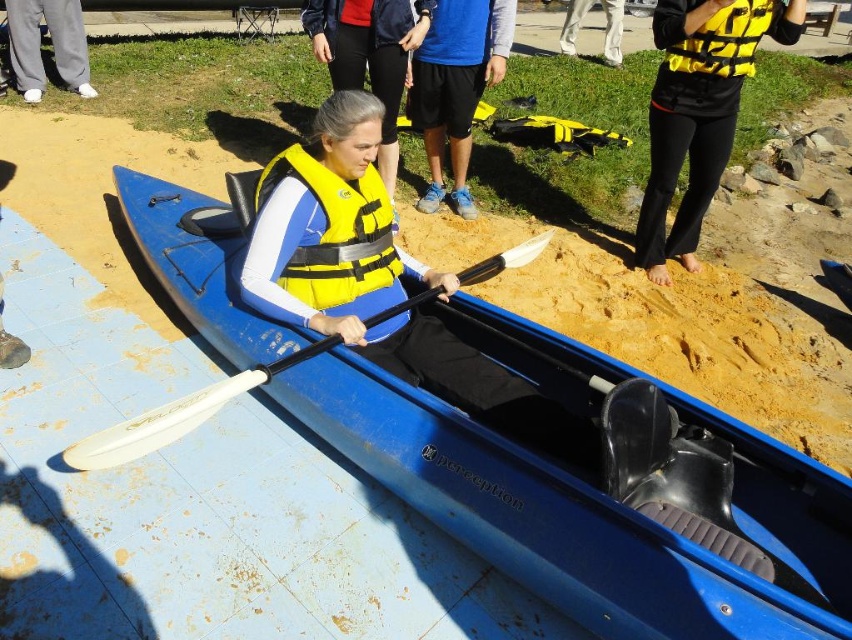
Does blue plastic kayak at center have a greater height compared to yellow/black life vest at upper right?

Indeed, blue plastic kayak at center has a greater height compared to yellow/black life vest at upper right.

Between point (548, 492) and point (686, 134), which one is positioned behind?

The point (686, 134) is behind.

The height and width of the screenshot is (640, 852). In order to click on blue plastic kayak at center in this screenshot , I will do `click(597, 490)`.

Which of these two, blue plastic kayak at center or yellow matte safety vest at center, stands shorter?

With less height is yellow matte safety vest at center.

Which is behind, point (216, 333) or point (317, 177)?

The point (216, 333) is behind.

I want to click on blue plastic kayak at center, so click(x=597, y=490).

Can you confirm if blue synthetic shorts at center is wider than yellow matte life jacket at upper center?

Indeed, blue synthetic shorts at center has a greater width compared to yellow matte life jacket at upper center.

Does point (421, 196) come closer to viewer compared to point (741, 16)?

No, (421, 196) is further to viewer.

Where is `blue synthetic shorts at center`? blue synthetic shorts at center is located at coordinates (455, 86).